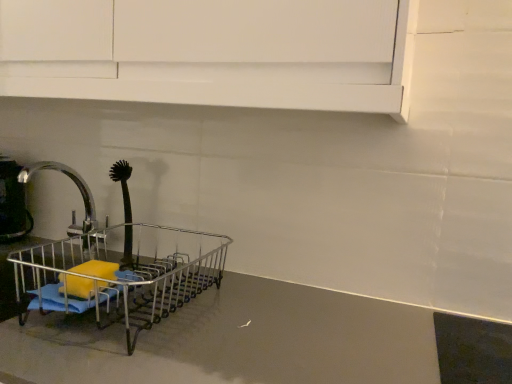
The height and width of the screenshot is (384, 512). I want to click on free point to the right of black rubber brush at left, so click(182, 270).